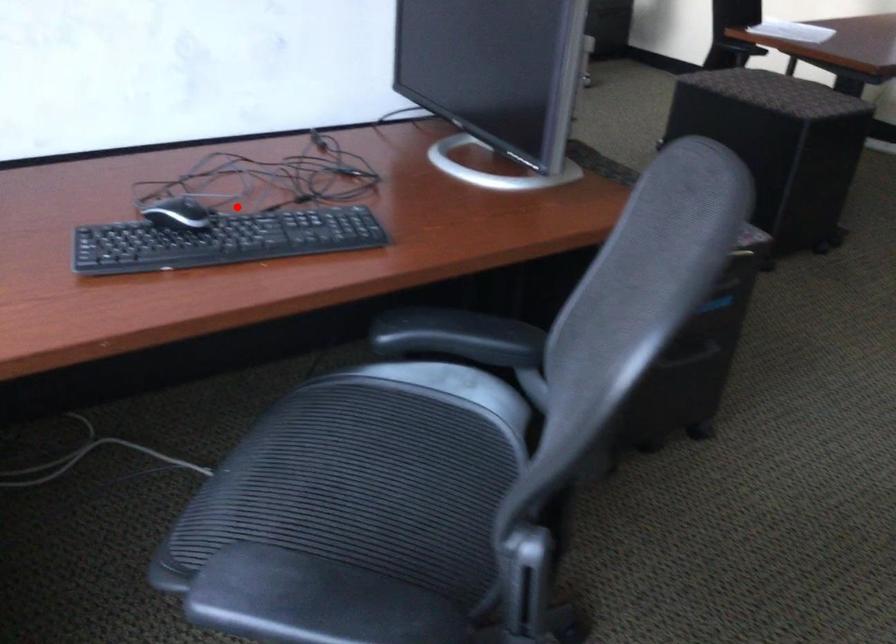
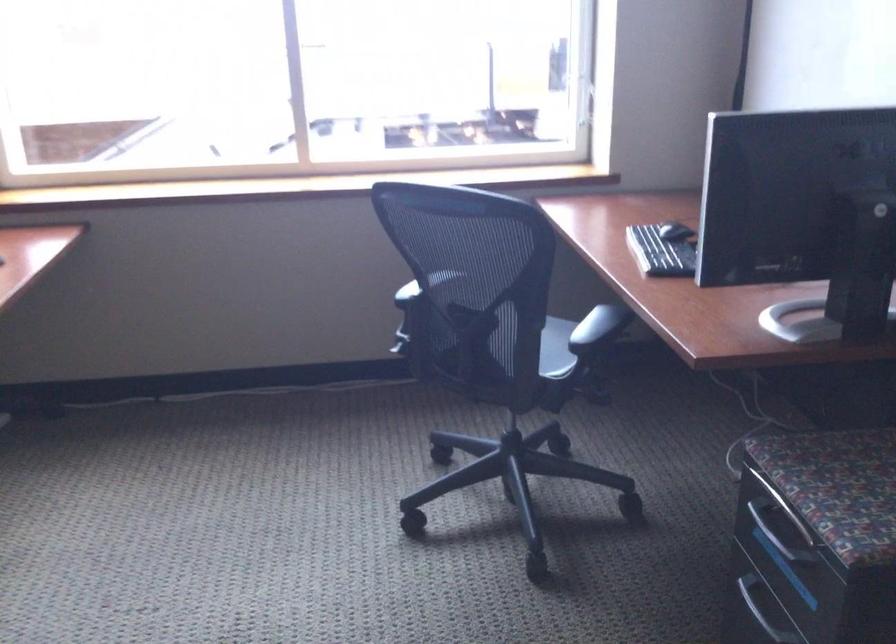
Question: I am providing you with two images of the same scene from different viewpoints. In image1, a red point is highlighted. Considering the same 3D point in image2, which of the following is correct?

Choices:
 (A) It is closer
 (B) It is farther

Answer: (B)